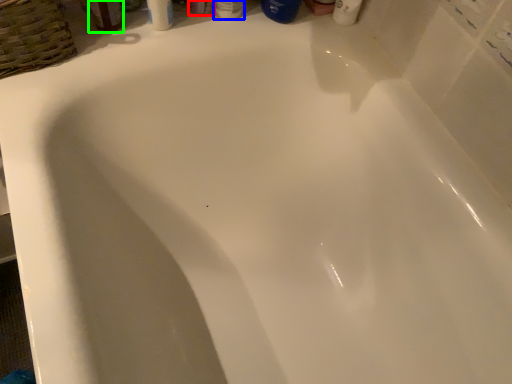
Question: Based on their relative distances, which object is farther from toiletry (highlighted by a red box)? Choose from toiletry (highlighted by a blue box) and mouthwash (highlighted by a green box).

Choices:
 (A) toiletry
 (B) mouthwash

Answer: (B)